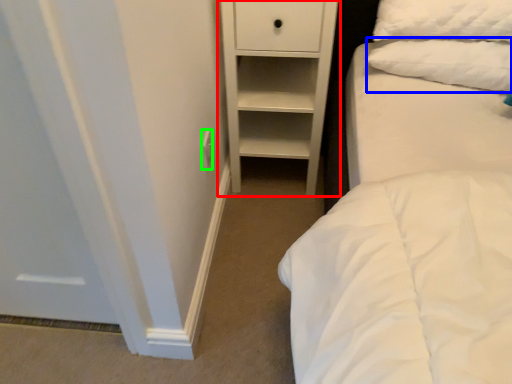
Question: Which object is the farthest from chest of drawers (highlighted by a red box)? Choose among these: pillow (highlighted by a blue box) or electric outlet (highlighted by a green box).

Choices:
 (A) pillow
 (B) electric outlet

Answer: (B)